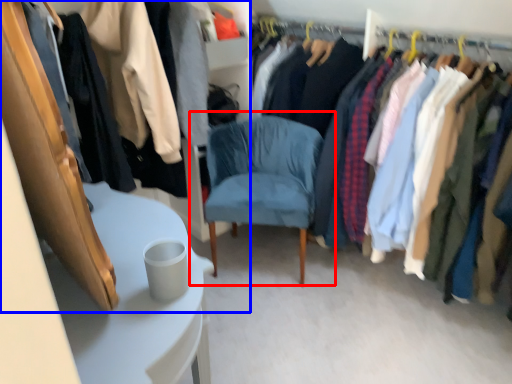
Question: Which object is further to the camera taking this photo, chair (highlighted by a red box) or closet (highlighted by a blue box)?

Choices:
 (A) chair
 (B) closet

Answer: (A)